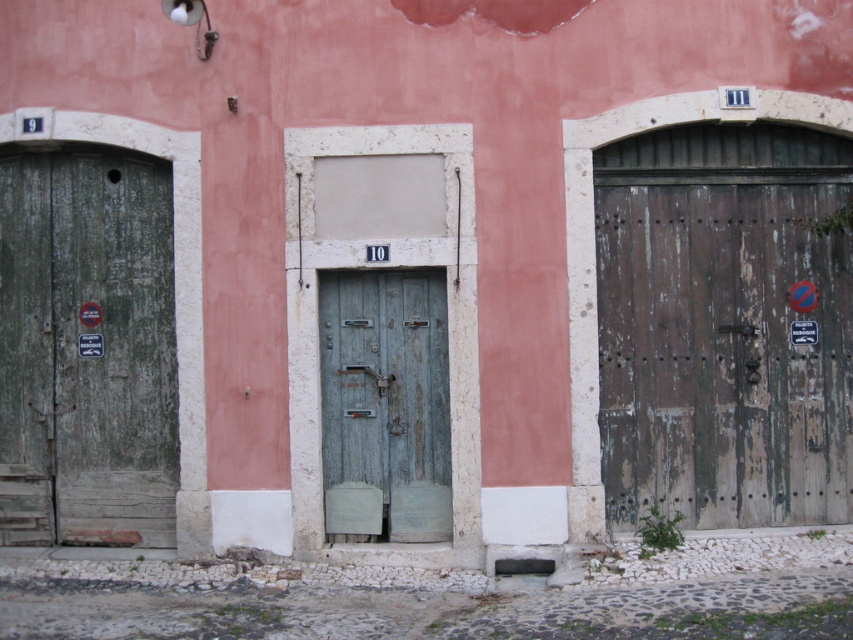
Consider the image. Can you confirm if green weathered wood door at left is bigger than green weathered wood door at center?

Correct, green weathered wood door at left is larger in size than green weathered wood door at center.

Which is behind, point (82, 513) or point (416, 346)?

Point (82, 513)

Image resolution: width=853 pixels, height=640 pixels. In order to click on green weathered wood door at left in this screenshot , I will do `click(86, 349)`.